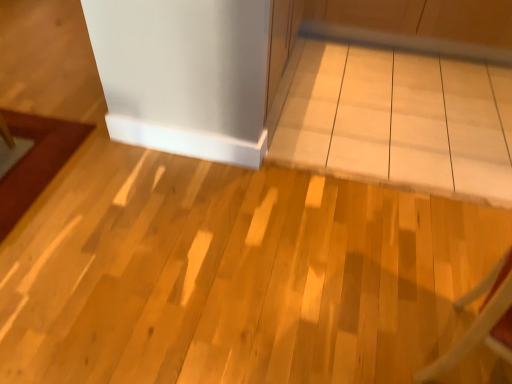
Image resolution: width=512 pixels, height=384 pixels. In order to click on vacant space behind wooden chair at lower right in this screenshot , I will do `click(434, 271)`.